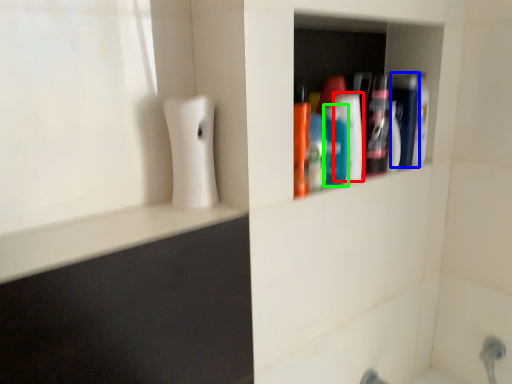
Question: Which object is the farthest from mouthwash (highlighted by a red box)? Choose among these: mouthwash (highlighted by a blue box) or mouthwash (highlighted by a green box).

Choices:
 (A) mouthwash
 (B) mouthwash

Answer: (A)